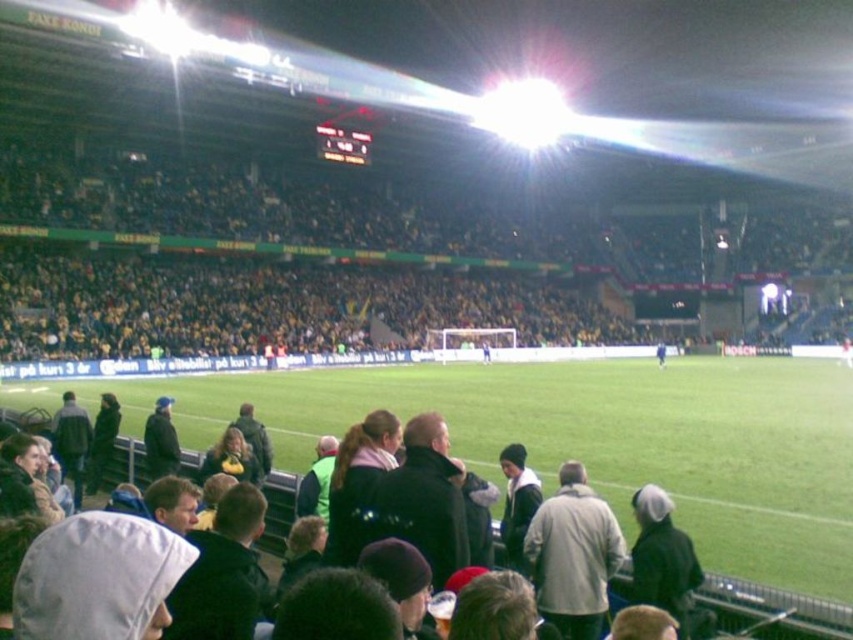
You are a photographer trying to capture a clear shot of the yellow jersey at upper center and the dark gray hooded sweatshirt at lower left. Considering their sizes, which one might be easier to focus on in your camera viewfinder?

The yellow jersey at upper center has a larger width than the dark gray hooded sweatshirt at lower left, making it easier to focus on in the camera viewfinder due to its bigger size.